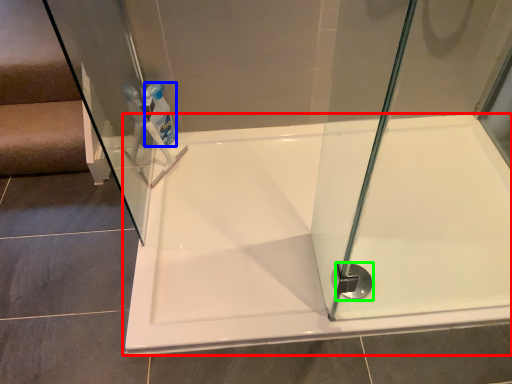
Question: Which object is the farthest from bathtub (highlighted by a red box)? Choose among these: cleaning product (highlighted by a blue box) or shower (highlighted by a green box).

Choices:
 (A) cleaning product
 (B) shower

Answer: (A)